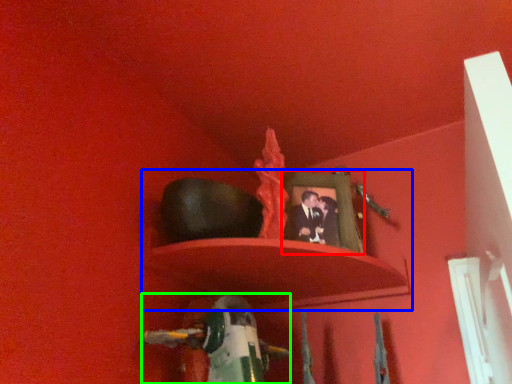
Question: Which is farther away from picture frame (highlighted by a red box)? shelf (highlighted by a blue box) or toy (highlighted by a green box)?

Choices:
 (A) shelf
 (B) toy

Answer: (B)